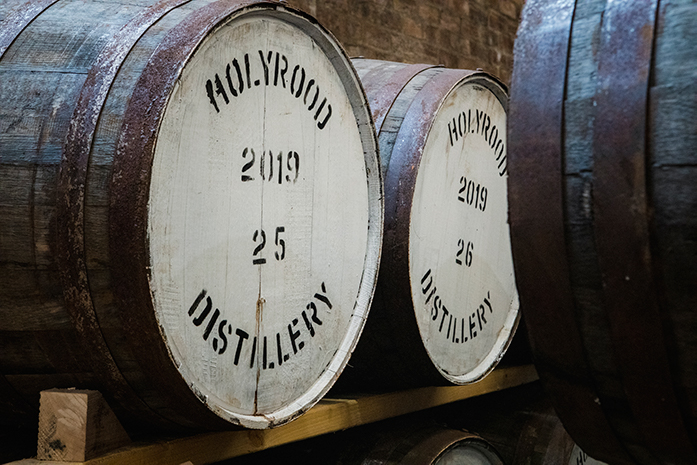
The image size is (697, 465). In order to click on white paint in this screenshot , I will do `click(212, 285)`, `click(449, 276)`.